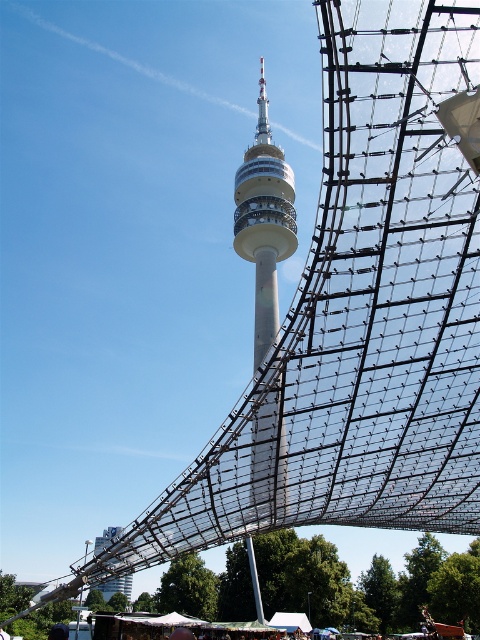
You are standing at the base of the tower and want to place a new decorative element at the exact center of the image. Given the coordinates provided for the metallic mesh structure at lower center, can you determine if the structure is positioned to the left or right of the image center?

The metallic mesh structure at lower center is located at coordinates point (368,582). Since the x coordinate is 0.912, which is greater than 0.5, the structure is positioned to the right of the image center.